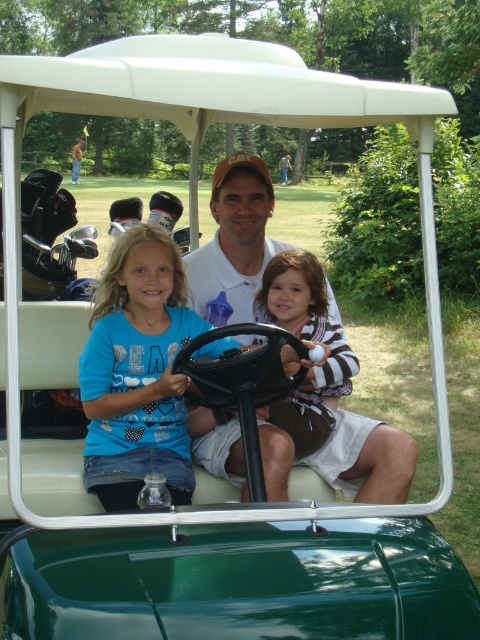
Who is higher up, matte white shirt at center or striped fabric ball at center?

matte white shirt at center is above.

Is matte white shirt at center in front of striped fabric ball at center?

No.

What do you see at coordinates (235, 237) in the screenshot? I see `matte white shirt at center` at bounding box center [235, 237].

Image resolution: width=480 pixels, height=640 pixels. What are the coordinates of `matte white shirt at center` in the screenshot? It's located at (235, 237).

Which is above, blue cotton shirt at center or matte white shirt at center?

matte white shirt at center

Which of these two, blue cotton shirt at center or matte white shirt at center, stands shorter?

Standing shorter between the two is matte white shirt at center.

Locate an element on the screen. The height and width of the screenshot is (640, 480). blue cotton shirt at center is located at coordinates (137, 371).

Does blue cotton shirt at center have a lesser height compared to striped fabric ball at center?

Incorrect, blue cotton shirt at center's height does not fall short of striped fabric ball at center's.

Is point (106, 413) positioned before point (279, 410)?

Yes, point (106, 413) is in front of point (279, 410).

Find the location of a particular element. blue cotton shirt at center is located at coordinates (137, 371).